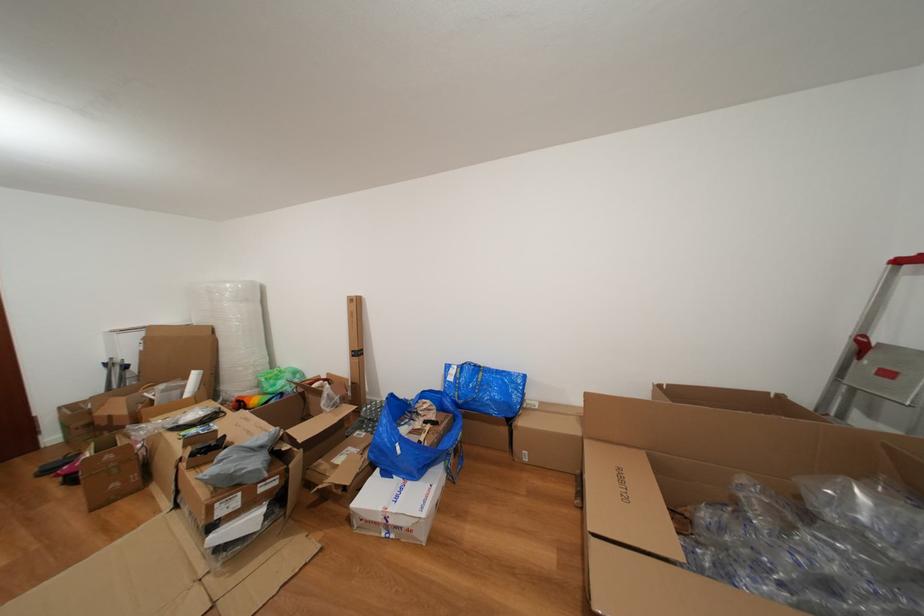
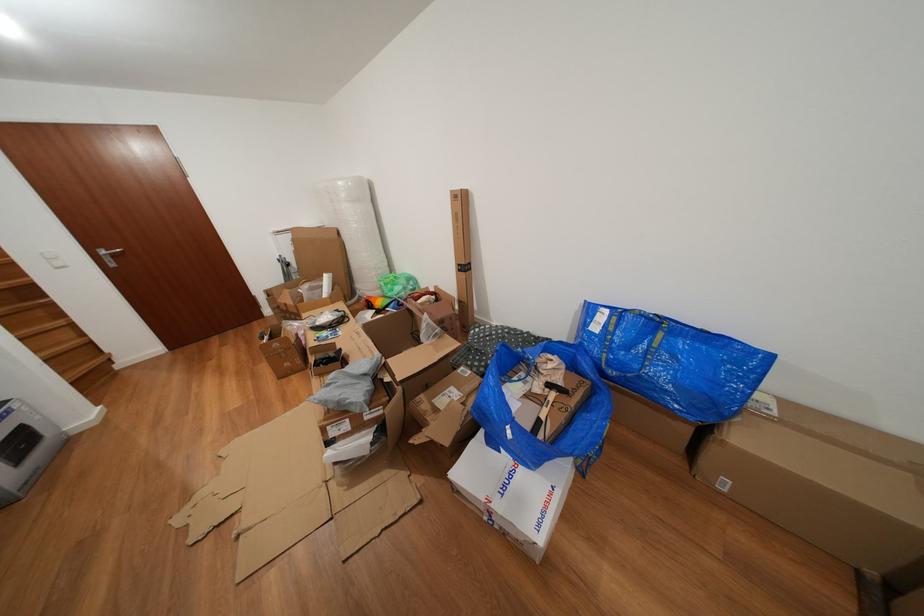
Where in the second image is the point corresponding to (x=415, y=431) from the first image?

(529, 389)